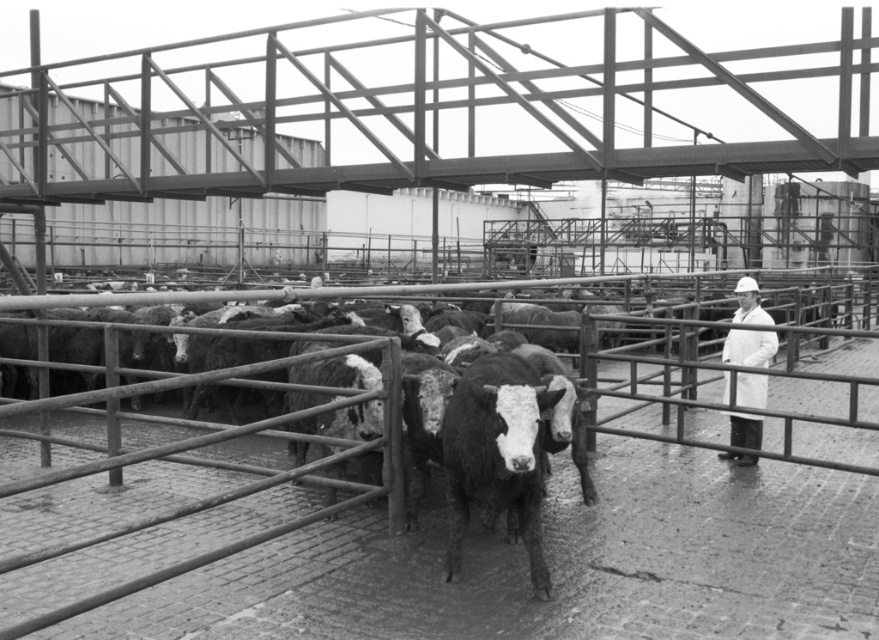
You are standing in the livestock facility and want to determine which of the two points, point (452,506) or point (747,298), is nearer to you. Based on the scene description, which point is closer?

Point (452,506) is closer to the camera than point (747,298), so it is the nearer point.

Consider the image. You are a farmer trying to locate a specific black and white textured bull in the livestock facility. The bull is at point (496, 454). From your current position, which direction should you move to reach the bull?

The point (496, 454) corresponds to the black and white textured bull at center, so you should move towards the center of the livestock facility to reach it.